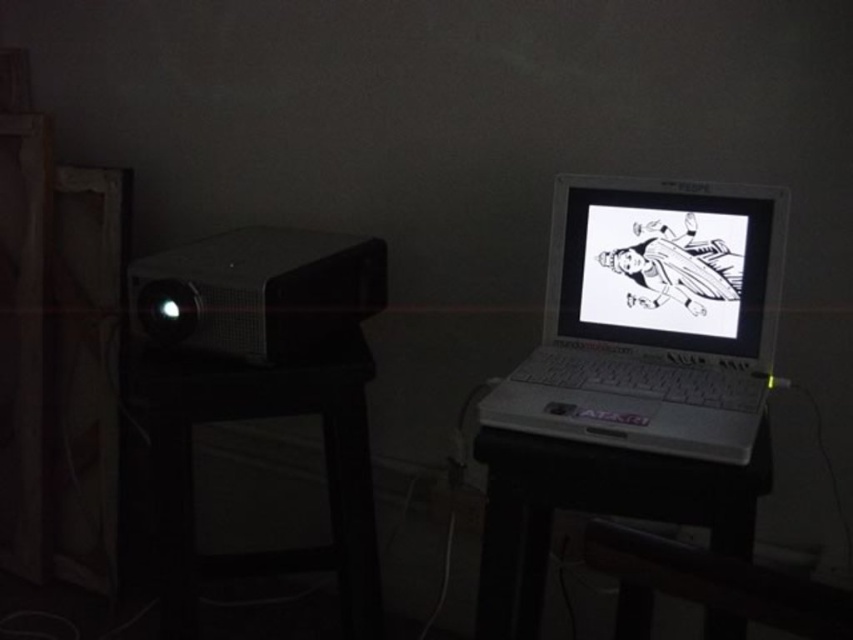
Question: Can you confirm if white plastic laptop at upper right is smaller than white glossy screen at center?

Choices:
 (A) yes
 (B) no

Answer: (B)

Question: Estimate the real-world distances between objects in this image. Which object is farther from the white glossy screen at center?

Choices:
 (A) white plastic table at center
 (B) white plastic laptop at upper right

Answer: (A)

Question: Where is white glossy screen at center located in relation to white plastic table at center in the image?

Choices:
 (A) above
 (B) below

Answer: (A)

Question: Among these points, which one is nearest to the camera?

Choices:
 (A) (764, 188)
 (B) (689, 262)

Answer: (A)

Question: Is white glossy screen at center thinner than white plastic table at center?

Choices:
 (A) no
 (B) yes

Answer: (B)

Question: Among these points, which one is farthest from the camera?

Choices:
 (A) (527, 598)
 (B) (583, 417)
 (C) (715, 243)

Answer: (A)